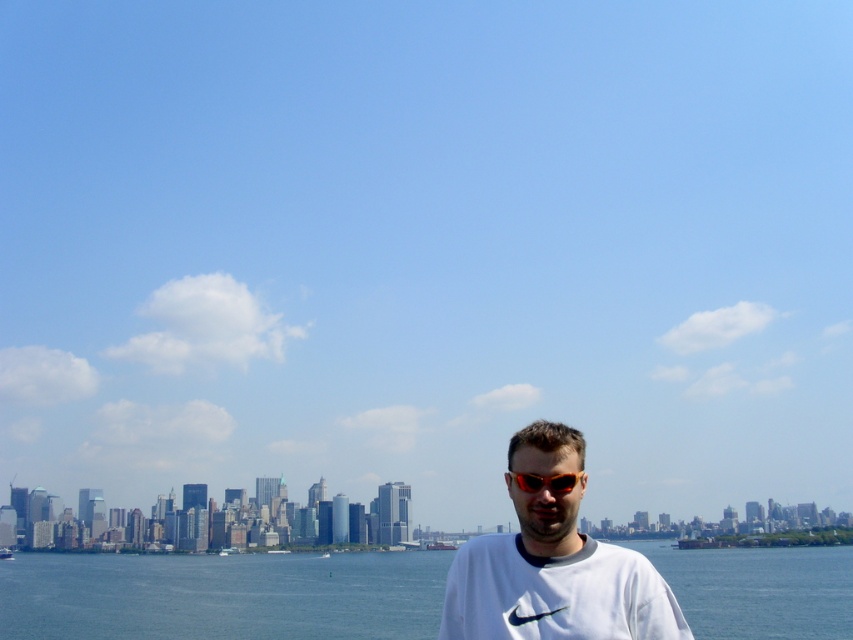
Between blue water at lower center and white cotton t-shirt at center, which one is positioned higher?

white cotton t-shirt at center

Is blue water at lower center to the right of white cotton t-shirt at center from the viewer's perspective?

No, blue water at lower center is not to the right of white cotton t-shirt at center.

Locate an element on the screen. blue water at lower center is located at coordinates (222, 595).

Find the location of a particular element. Image resolution: width=853 pixels, height=640 pixels. blue water at lower center is located at coordinates (222, 595).

Which is behind, point (363, 573) or point (519, 486)?

The point (363, 573) is behind.

Between blue water at lower center and orange reflective sunglasses at center, which one has more height?

blue water at lower center is taller.

Find the location of a particular element. The height and width of the screenshot is (640, 853). blue water at lower center is located at coordinates (222, 595).

Between point (541, 618) and point (531, 476), which one is positioned behind?

Positioned behind is point (531, 476).

Can you confirm if white cotton t-shirt at center is positioned below orange reflective sunglasses at center?

Yes.

Measure the distance between white cotton t-shirt at center and camera.

white cotton t-shirt at center and camera are 591.91 meters apart.

Image resolution: width=853 pixels, height=640 pixels. Identify the location of white cotton t-shirt at center. (553, 564).